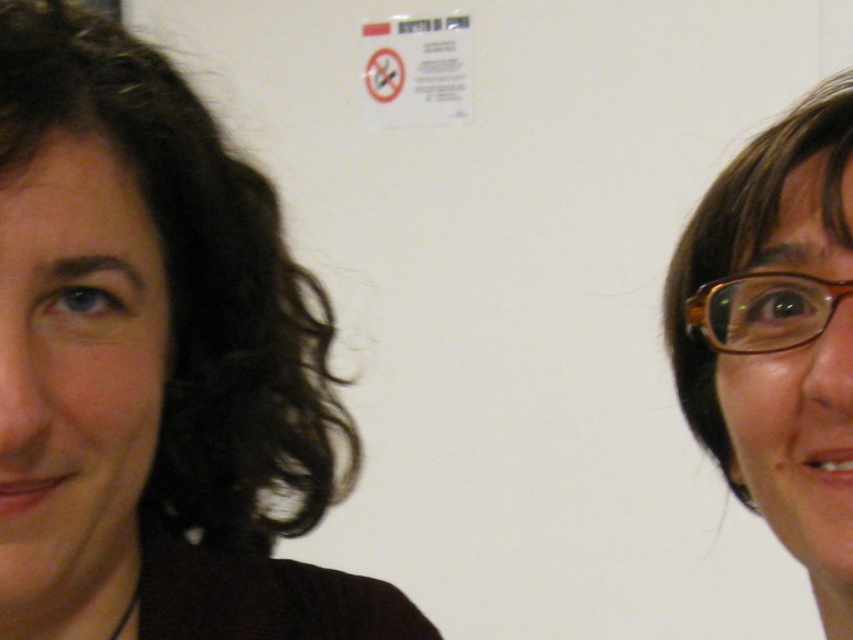
You are a photographer adjusting the focus on your camera. You notice two pairs of glasses on the person at the right side of the image. The brown matte glasses at right and the brown plastic glasses at right. Which pair is closer to the camera?

The brown matte glasses at right is 2.35 inches closer to the camera than the brown plastic glasses at right.

You are standing in front of the two people in the image. The person on the left has curly dark hair and is wearing a dark top. The person on the right has straight brown hair and glasses. There is a point marked at coordinates [154,364]. Which person is closer to that point?

The dark brown hair at left is located at point [154,364], so the person on the left with curly dark hair is closer to that point.